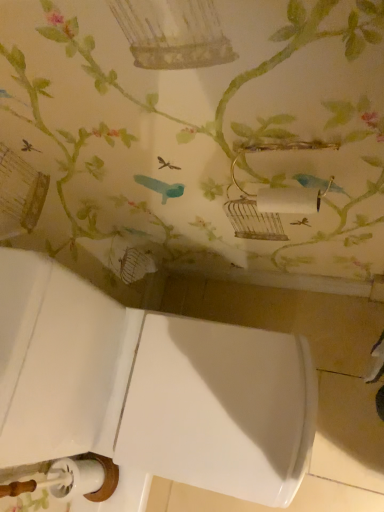
Question: Should I look upward or downward to see white glossy sink at lower left?

Choices:
 (A) up
 (B) down

Answer: (B)